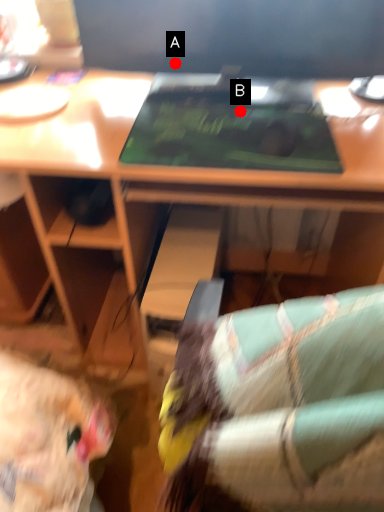
Question: Two points are circled on the image, labeled by A and B beside each circle. Which of the following is the closest to the observer?

Choices:
 (A) A is closer
 (B) B is closer

Answer: (B)